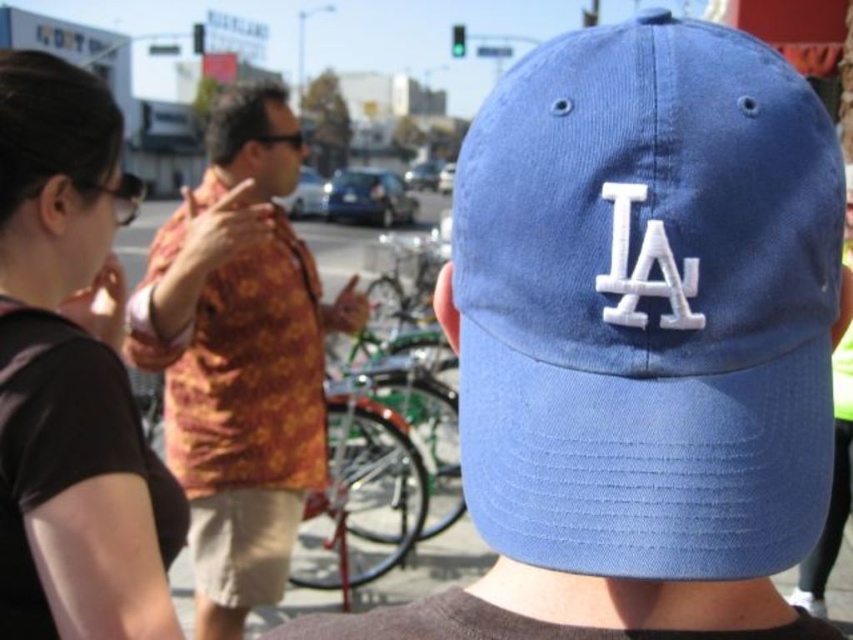
Looking at this image, you are a photographer standing at the center of the street scene. You want to take a photo of the blue fabric baseball cap at center. Where should you aim your camera to capture it?

You should aim your camera at the point with coordinates 0.477 on the x axis and 0.761 on the y axis to capture the blue fabric baseball cap at center.

You are a tailor who needs to determine which cap to adjust for a customer. The customer wants a cap with a wider brim. Which cap between the blue fabric baseball cap at center and the matte blue cap at center should you choose?

The matte blue cap at center should be chosen because it has a greater width than the blue fabric baseball cap at center according to the description.

You are a photographer trying to capture a candid shot of the matte blue cap at center without including the black fabric shirt at upper left in the frame. Based on their positions, is this possible?

The black fabric shirt at upper left has a lesser height compared to matte blue cap at center, so it is possible to capture the matte blue cap at center without including the black fabric shirt at upper left by adjusting the camera angle to exclude the lower part of the frame where the shirt is located.